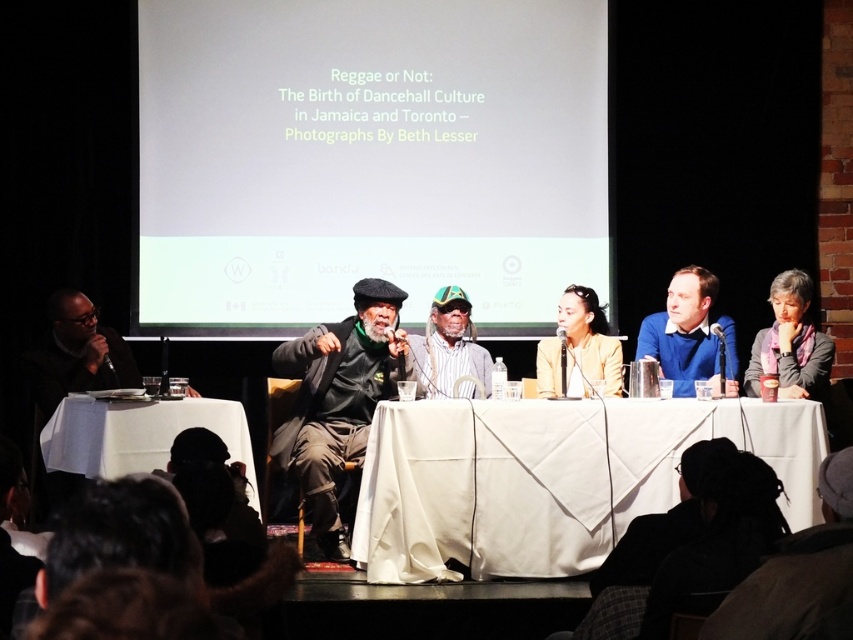
Between point (245, 452) and point (421, 387), which one is positioned in front?

Positioned in front is point (245, 452).

Does point (57, 429) come behind point (434, 337)?

No, (57, 429) is in front of (434, 337).

The height and width of the screenshot is (640, 853). In order to click on white cloth-covered table at lower left in this screenshot , I will do `click(138, 435)`.

Can you confirm if white cloth-covered table at lower left is shorter than matte black suit at left?

Yes, white cloth-covered table at lower left is shorter than matte black suit at left.

Does white cloth-covered table at lower left appear on the right side of matte black suit at left?

Yes, white cloth-covered table at lower left is to the right of matte black suit at left.

The width and height of the screenshot is (853, 640). Describe the element at coordinates (138, 435) in the screenshot. I see `white cloth-covered table at lower left` at that location.

Identify the location of white cloth-covered table at lower left. The height and width of the screenshot is (640, 853). (138, 435).

Can you confirm if matte black suit at left is positioned to the left of matte yellow blazer at center?

Indeed, matte black suit at left is positioned on the left side of matte yellow blazer at center.

Which of these two, matte black suit at left or matte yellow blazer at center, stands taller?

Answer: With more height is matte black suit at left.

Is point (39, 368) positioned in front of point (547, 362)?

That is True.

Find the location of a particular element. The image size is (853, 640). matte black suit at left is located at coordinates (77, 353).